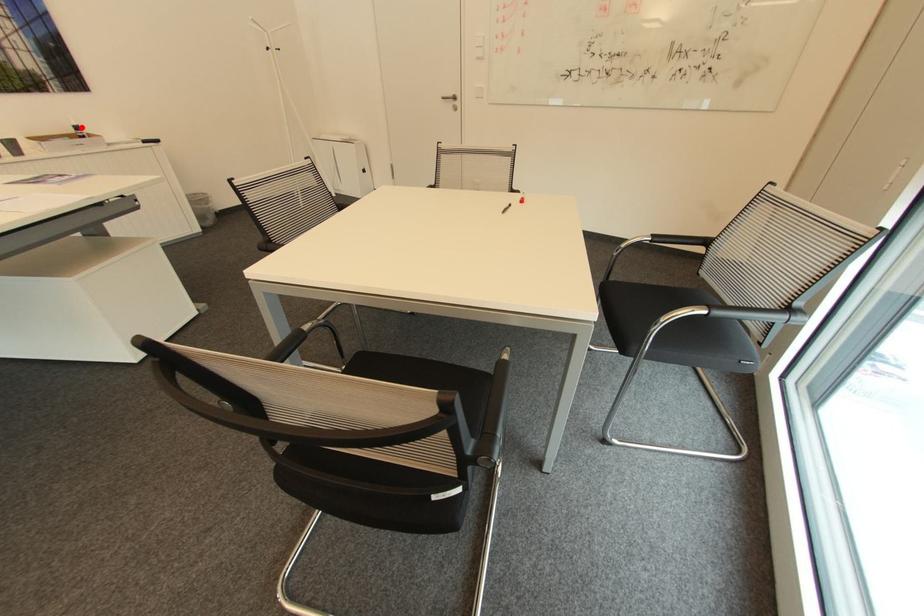
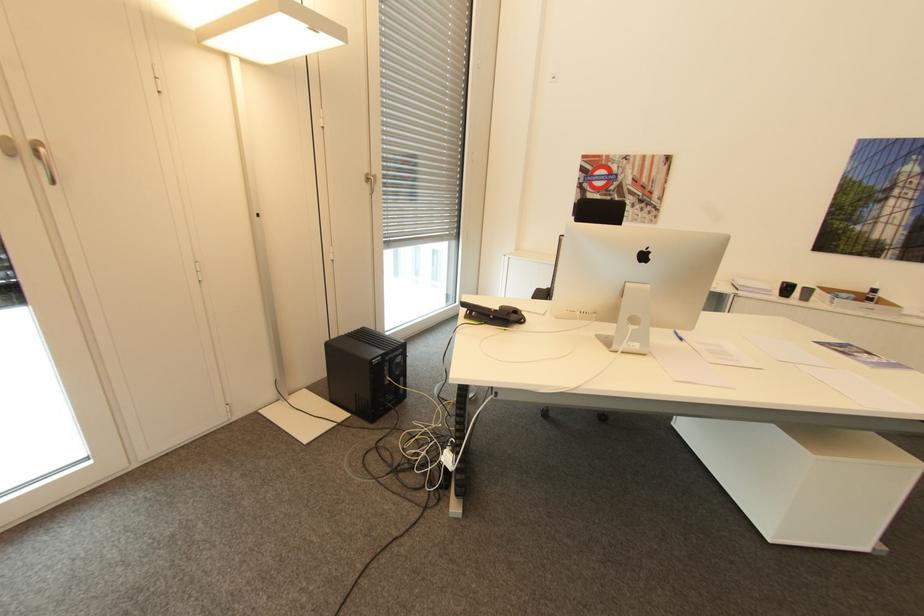
In the second image, find the point that corresponds to the highlighted location in the first image.

(879, 290)